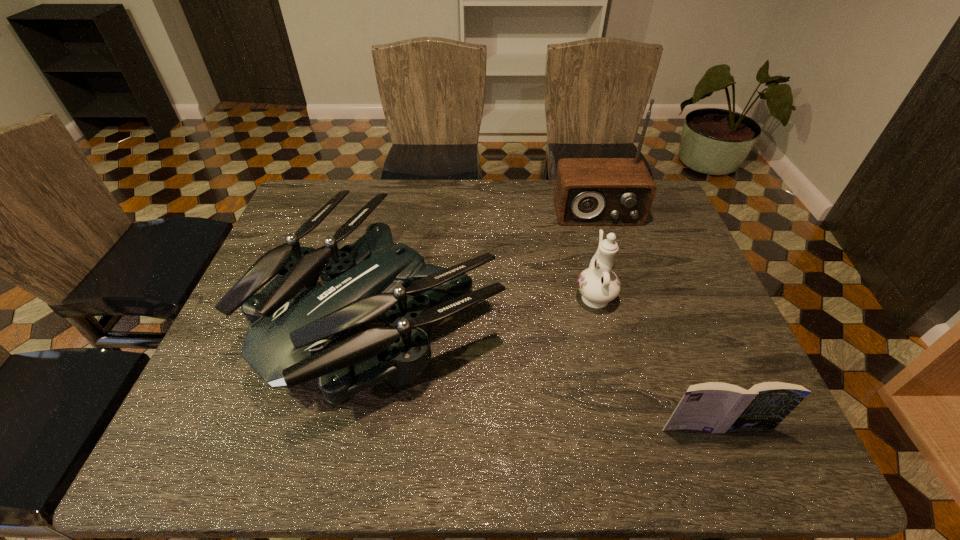
Locate an element on the screen. The height and width of the screenshot is (540, 960). object situated at the far edge is located at coordinates (588, 191).

I want to click on drone present at the near edge, so [299, 331].

The height and width of the screenshot is (540, 960). Identify the location of book located at the near edge. (715, 407).

Locate an element on the screen. This screenshot has height=540, width=960. object located at the left edge is located at coordinates (299, 331).

Image resolution: width=960 pixels, height=540 pixels. I want to click on radio receiver positioned at the right edge, so click(588, 191).

Locate an element on the screen. The height and width of the screenshot is (540, 960). book present at the right edge is located at coordinates 715,407.

Locate an element on the screen. Image resolution: width=960 pixels, height=540 pixels. object that is at the near left corner is located at coordinates (299, 331).

The image size is (960, 540). In order to click on object situated at the far right corner in this screenshot , I will do `click(588, 191)`.

At what (x,y) coordinates should I click in order to perform the action: click on object positioned at the near right corner. Please return your answer as a coordinate pair (x, y). Looking at the image, I should click on (715, 407).

Locate an element on the screen. The width and height of the screenshot is (960, 540). vacant space at the far edge is located at coordinates (437, 187).